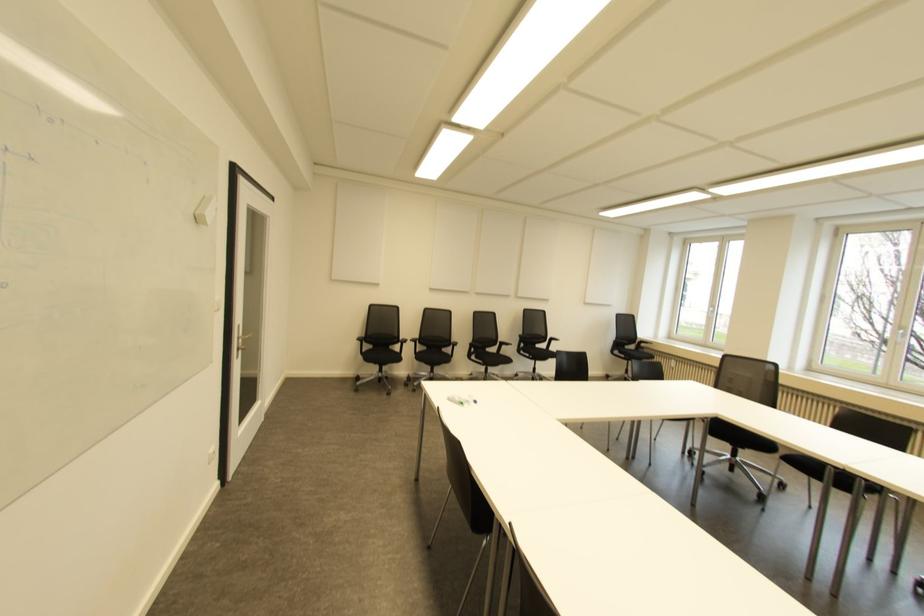
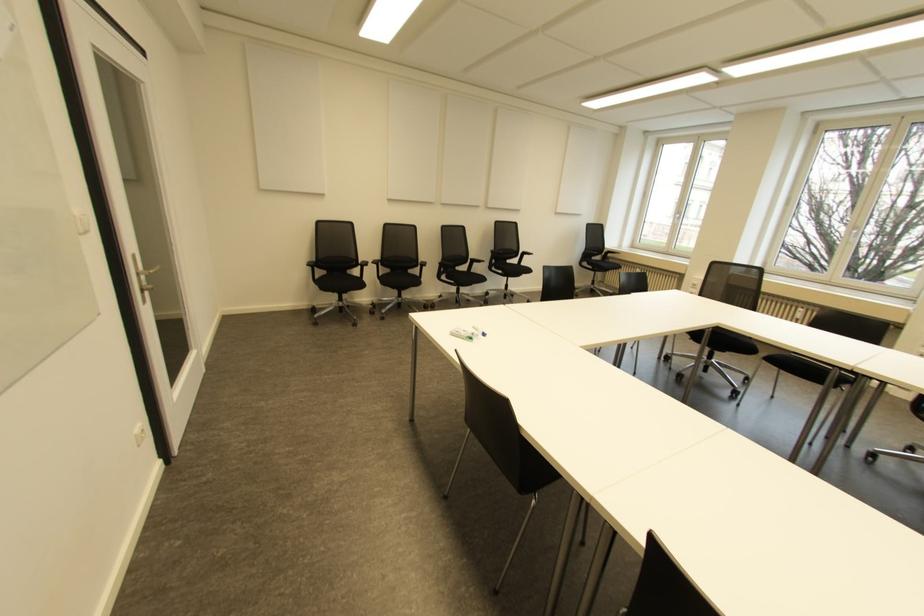
The point at (645, 350) is marked in the first image. Where is the corresponding point in the second image?

(610, 261)